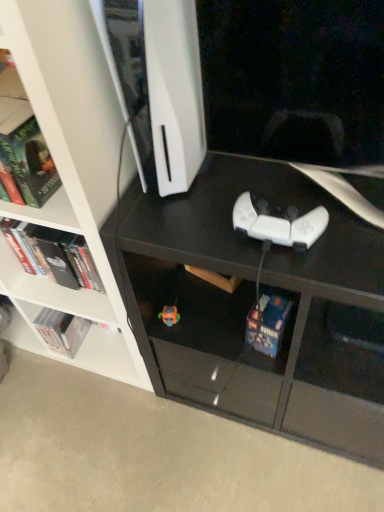
Question: Can you confirm if hardcover book at left, the second book when ordered from front to back, is wider than hardcover book at lower center, which is counted as the third book, starting from the left?

Choices:
 (A) yes
 (B) no

Answer: (B)

Question: Is hardcover book at left, the second book when ordered from front to back, further to camera compared to hardcover book at lower center, which is counted as the third book, starting from the left?

Choices:
 (A) no
 (B) yes

Answer: (B)

Question: Would you say hardcover book at left, which ranks as the second book in back-to-front order, is a long distance from hardcover book at lower center, marked as the 3th book in a back-to-front arrangement?

Choices:
 (A) no
 (B) yes

Answer: (A)

Question: Does hardcover book at left, which is the 2th book from right to left, appear on the right side of hardcover book at lower center, which ranks as the first book in right-to-left order?

Choices:
 (A) no
 (B) yes

Answer: (A)

Question: From a real-world perspective, is hardcover book at left, the second book when ordered from front to back, under hardcover book at lower center, which is counted as the third book, starting from the left?

Choices:
 (A) no
 (B) yes

Answer: (A)

Question: Does hardcover book at left, acting as the second book starting from the left, have a smaller size compared to hardcover book at lower center, which is counted as the third book, starting from the left?

Choices:
 (A) yes
 (B) no

Answer: (B)

Question: From a real-world perspective, is hardcover book at left, the second book when ordered from front to back, physically below translucent orange toy at lower center?

Choices:
 (A) no
 (B) yes

Answer: (A)

Question: Does hardcover book at left, acting as the second book starting from the left, appear on the left side of translucent orange toy at lower center?

Choices:
 (A) no
 (B) yes

Answer: (B)

Question: Is hardcover book at left, acting as the second book starting from the left, oriented towards translucent orange toy at lower center?

Choices:
 (A) no
 (B) yes

Answer: (A)

Question: Is the surface of hardcover book at left, which ranks as the second book in back-to-front order, in direct contact with translucent orange toy at lower center?

Choices:
 (A) yes
 (B) no

Answer: (B)

Question: Is hardcover book at left, which is the 2th book from right to left, looking in the opposite direction of translucent orange toy at lower center?

Choices:
 (A) yes
 (B) no

Answer: (B)

Question: Considering the relative sizes of hardcover book at left, the second book when ordered from front to back, and translucent orange toy at lower center in the image provided, is hardcover book at left, the second book when ordered from front to back, taller than translucent orange toy at lower center?

Choices:
 (A) no
 (B) yes

Answer: (B)

Question: From a real-world perspective, is hardcover book at lower center, arranged as the first book when viewed from the front, under translucent orange toy at lower center?

Choices:
 (A) no
 (B) yes

Answer: (A)